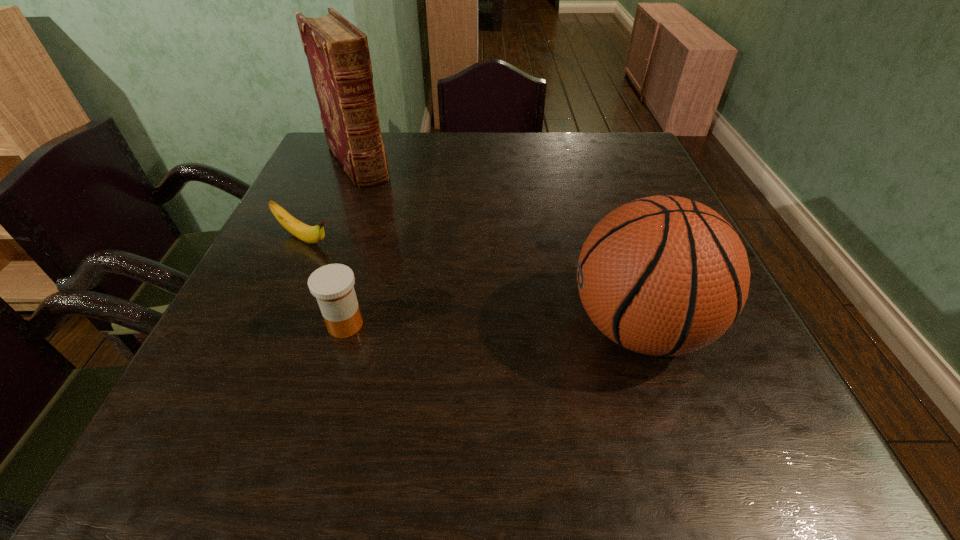
I want to click on banana present at the left edge, so click(310, 234).

I want to click on object situated at the right edge, so click(663, 275).

The image size is (960, 540). In order to click on object present at the far left corner in this screenshot , I will do `click(338, 56)`.

Where is `object located at the near right corner`? This screenshot has height=540, width=960. object located at the near right corner is located at coordinates (663, 275).

Locate an element on the screen. blank space at the far edge of the desktop is located at coordinates (415, 152).

This screenshot has height=540, width=960. I want to click on free region at the near edge, so click(x=445, y=367).

This screenshot has height=540, width=960. I want to click on vacant space at the left edge, so click(x=301, y=329).

Locate an element on the screen. vacant space at the near left corner is located at coordinates (205, 362).

You are a GUI agent. You are given a task and a screenshot of the screen. Output one action in this format:
    pyautogui.click(x=<x>, y=<y>)
    Task: Click on the vacant region at the far right corner of the desktop
    
    Given the screenshot: What is the action you would take?
    pyautogui.click(x=631, y=137)

Identify the location of free space at the near right corner. The width and height of the screenshot is (960, 540). (709, 376).